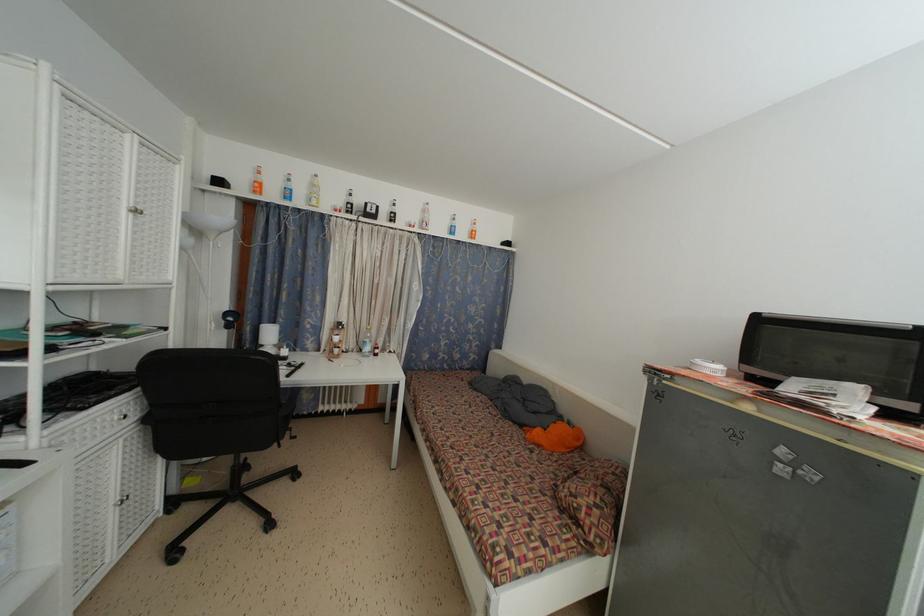
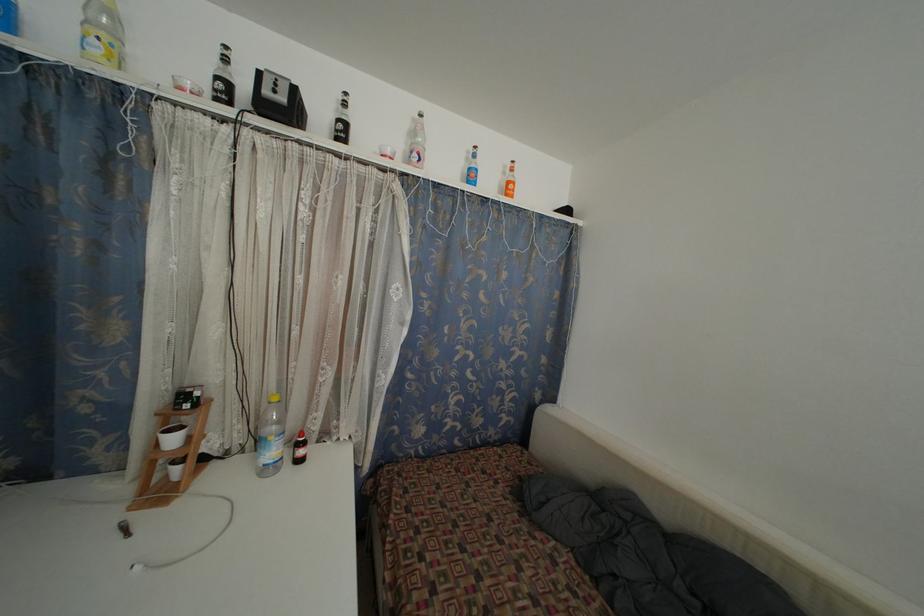
Find the pixel in the second image that matches [378,217] in the first image.

(286, 105)